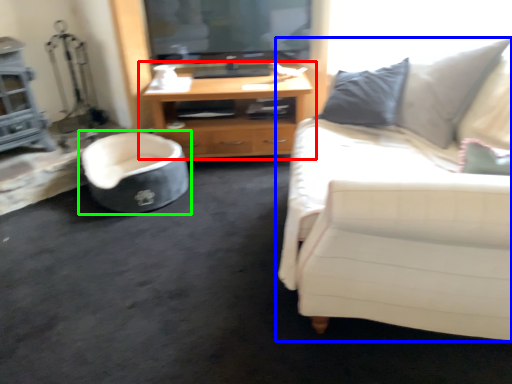
Question: Which is farther away from cabinetry (highlighted by a red box)? studio couch (highlighted by a blue box) or chair (highlighted by a green box)?

Choices:
 (A) studio couch
 (B) chair

Answer: (A)